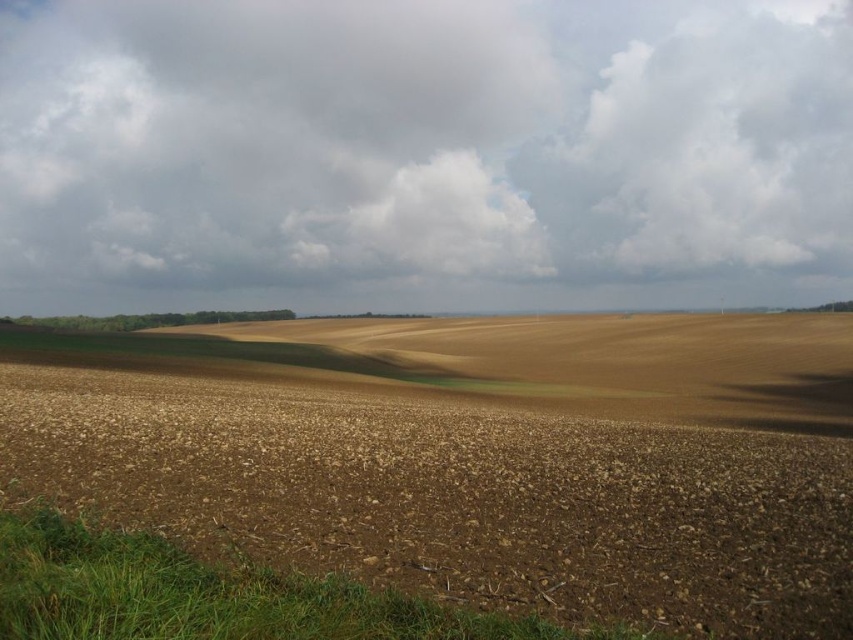
You are standing in the middle of the agricultural field and want to know how far the cloudy sky at upper center is from your current position. Can you determine the distance?

The cloudy sky at upper center is 147.39 meters away from the camera, so the distance from your current position in the middle of the agricultural field to the cloudy sky at upper center is approximately 147.39 meters.

You are a farmer planning to plant crops in the brown soil at center. Considering the cloudy sky at upper center, which object in the scene is wider?

The cloudy sky at upper center is wider than the brown soil at center according to the description.